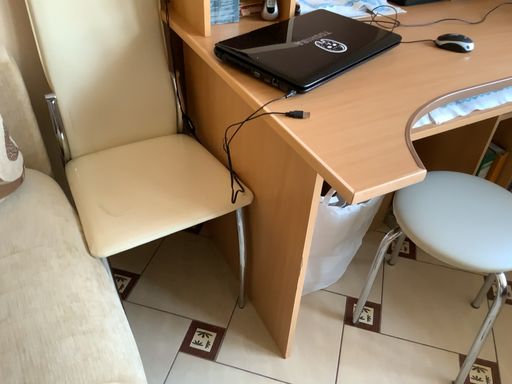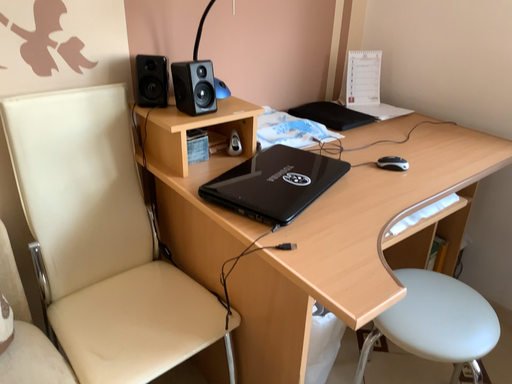
Question: Which way did the camera rotate in the video?

Choices:
 (A) rotated upward
 (B) rotated downward

Answer: (A)